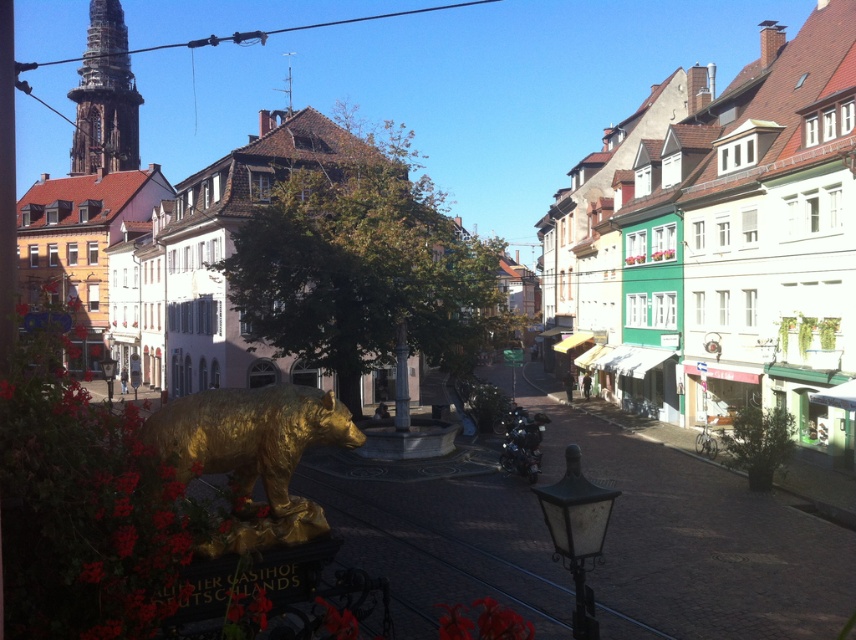
You are standing in the European town square and want to take a photo of both the golden bear statue and the distant buildings. You notice two points marked on your map at coordinates point (x=298, y=452) and point (x=108, y=26). Which point should you stand at to ensure both the statue and the buildings are in frame?

You should stand at point (x=298, y=452) because it is closer to the camera, allowing you to capture both the golden bear statue in the foreground and the distant buildings in the background in a single frame.

You are standing in the town square and want to take a photo of both the gold metallic bear at center and the golden stone tower at upper left. Which object should you position closer to the camera to ensure both are in the frame?

Since the gold metallic bear at center is closer to the viewer than the golden stone tower at upper left, you should position the camera closer to the gold metallic bear at center to ensure both are in the frame.

You are a tourist standing in the town square and want to take a photo that includes both the gold metallic bear at center and the golden stone tower at upper left. Considering their heights, which object will appear smaller in the photo?

The gold metallic bear at center will appear smaller in the photo because it is shorter than the golden stone tower at upper left.